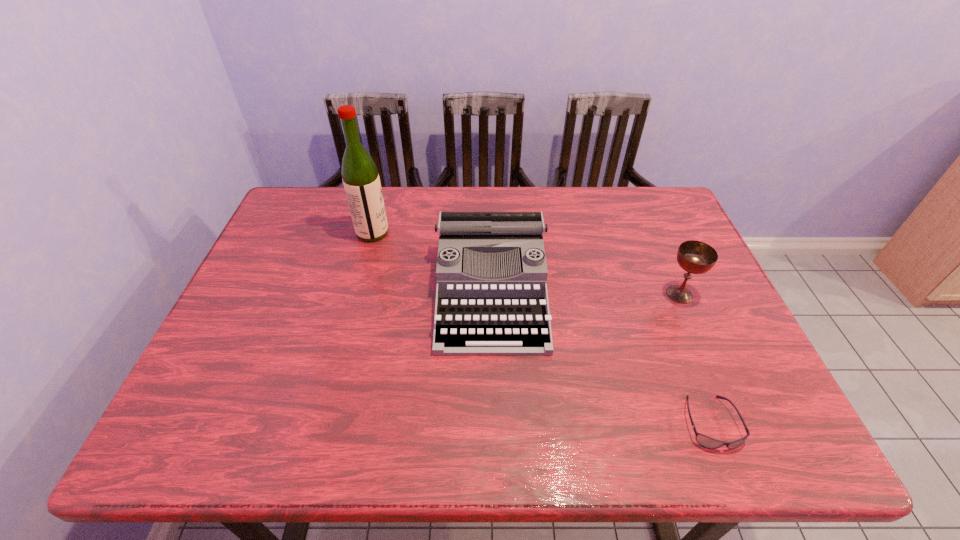
I want to click on free space at the far right corner, so click(635, 205).

Find the location of a particular element. The height and width of the screenshot is (540, 960). vacant space at the near right corner of the desktop is located at coordinates (708, 426).

Where is `vacant space in between the shortest object and the typewriter`? The width and height of the screenshot is (960, 540). vacant space in between the shortest object and the typewriter is located at coordinates (601, 357).

Find the location of `free spot between the chalice and the sunglasses`. free spot between the chalice and the sunglasses is located at coordinates (695, 359).

Locate an element on the screen. The height and width of the screenshot is (540, 960). vacant space that's between the typewriter and the chalice is located at coordinates (586, 293).

In order to click on vacant point located between the nearest object and the second object from left to right in this screenshot , I will do `click(601, 357)`.

The image size is (960, 540). I want to click on vacant area that lies between the nearest object and the chalice, so click(x=695, y=359).

Locate an element on the screen. free space between the chalice and the typewriter is located at coordinates (586, 293).

Identify the location of vacant space that's between the sunglasses and the typewriter. (601, 357).

Find the location of a particular element. This screenshot has width=960, height=540. free space between the sunglasses and the chalice is located at coordinates (695, 359).